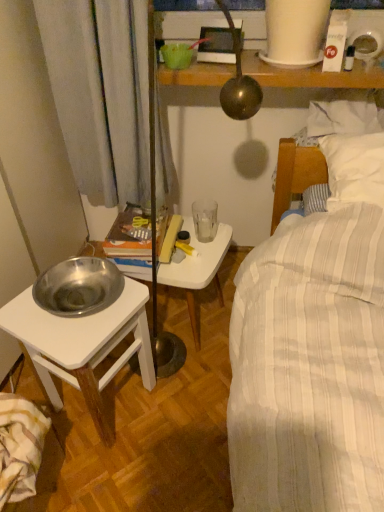
Locate an element on the screen. free point above white plastic table at center (from a real-world perspective) is located at coordinates (192, 253).